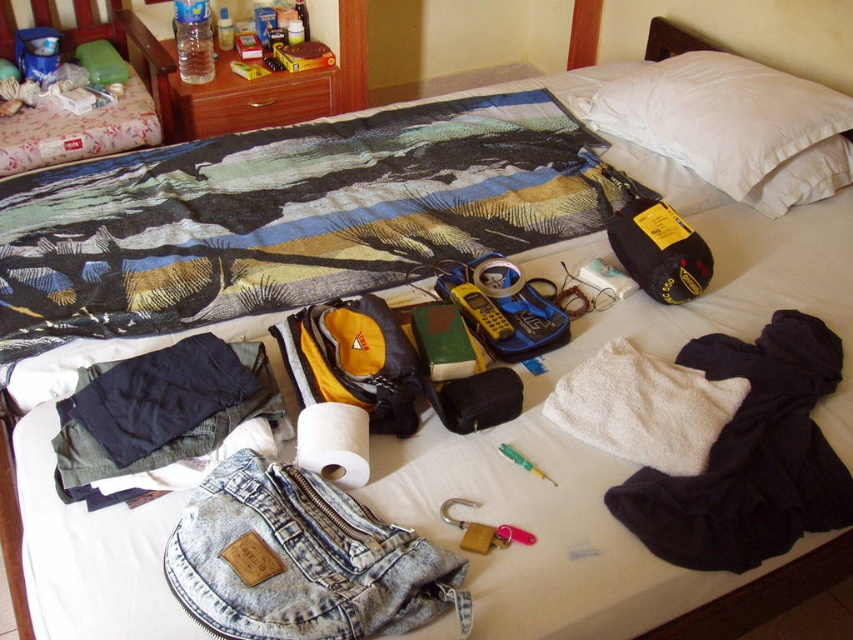
Question: Can you confirm if dark blue cotton pants at lower left is smaller than yellow plastic phone at center?

Choices:
 (A) no
 (B) yes

Answer: (A)

Question: Based on their relative distances, which object is nearer to the dark blue cotton pants at lower left?

Choices:
 (A) textured cotton blanket at center
 (B) white soft pillow at upper right
 (C) faded denim jacket at lower center
 (D) yellow plastic phone at center

Answer: (C)

Question: Which of these objects is positioned farthest from the faded denim jacket at lower center?

Choices:
 (A) textured cotton blanket at center
 (B) yellow plastic phone at center
 (C) dark blue cotton pants at lower left
 (D) white soft pillow at upper right

Answer: (D)

Question: Considering the relative positions of faded denim jacket at lower center and white soft towel at center in the image provided, where is faded denim jacket at lower center located with respect to white soft towel at center?

Choices:
 (A) above
 (B) below

Answer: (B)

Question: Which point is closer to the camera?

Choices:
 (A) white soft towel at center
 (B) dark blue cotton pants at lower left
 (C) yellow plastic phone at center

Answer: (A)

Question: Is faded denim jacket at lower center to the left of yellow plastic phone at center from the viewer's perspective?

Choices:
 (A) no
 (B) yes

Answer: (B)